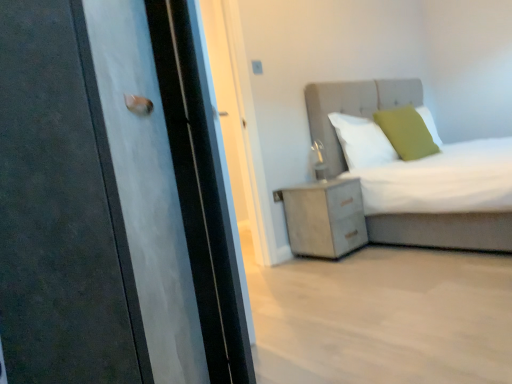
Question: Is the surface of matte black door at left in direct contact with white soft pillow at upper center, positioned as the 2th pillow in right-to-left order?

Choices:
 (A) no
 (B) yes

Answer: (A)

Question: Would you say matte black door at left is a long distance from white soft pillow at upper center, positioned as the 2th pillow in right-to-left order?

Choices:
 (A) no
 (B) yes

Answer: (B)

Question: Is matte black door at left at the right side of white soft pillow at upper center, positioned as the 2th pillow in right-to-left order?

Choices:
 (A) no
 (B) yes

Answer: (A)

Question: From the image's perspective, is matte black door at left on top of white soft pillow at upper center, positioned as the 2th pillow in right-to-left order?

Choices:
 (A) yes
 (B) no

Answer: (B)

Question: Would you say matte black door at left is outside white soft pillow at upper center, positioned as the 2th pillow in right-to-left order?

Choices:
 (A) yes
 (B) no

Answer: (A)

Question: Is green matte pillow at upper right, the second pillow when ordered from left to right, spatially inside white textured cabinet at lower right, or outside of it?

Choices:
 (A) outside
 (B) inside

Answer: (A)

Question: In terms of width, does green matte pillow at upper right, the second pillow when ordered from left to right, look wider or thinner when compared to white textured cabinet at lower right?

Choices:
 (A) thin
 (B) wide

Answer: (A)

Question: Is green matte pillow at upper right, the second pillow when ordered from left to right, bigger or smaller than white textured cabinet at lower right?

Choices:
 (A) big
 (B) small

Answer: (B)

Question: From the image's perspective, relative to white textured cabinet at lower right, is green matte pillow at upper right, the second pillow when ordered from left to right, above or below?

Choices:
 (A) above
 (B) below

Answer: (A)

Question: In terms of size, does matte black door at left appear bigger or smaller than matte gray bed at upper right?

Choices:
 (A) big
 (B) small

Answer: (B)

Question: Considering the positions of matte black door at left and matte gray bed at upper right in the image, is matte black door at left taller or shorter than matte gray bed at upper right?

Choices:
 (A) short
 (B) tall

Answer: (B)

Question: From the image's perspective, is matte black door at left located above or below matte gray bed at upper right?

Choices:
 (A) above
 (B) below

Answer: (B)

Question: Does point (86, 284) appear closer or farther from the camera than point (385, 100)?

Choices:
 (A) farther
 (B) closer

Answer: (B)

Question: Is green matte pillow at upper right, the second pillow when ordered from left to right, taller or shorter than matte black door at left?

Choices:
 (A) short
 (B) tall

Answer: (A)

Question: Is green matte pillow at upper right, the second pillow when ordered from left to right, spatially inside matte black door at left, or outside of it?

Choices:
 (A) inside
 (B) outside

Answer: (B)